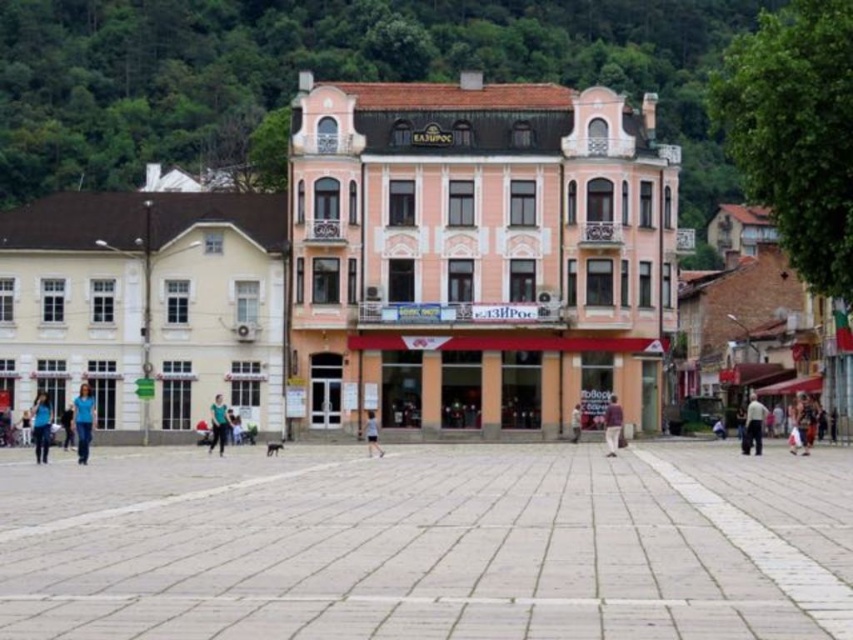
Consider the image. Who is shorter, blue fabric shirt at lower left or light brown leather jacket at center?

light brown leather jacket at center is shorter.

Measure the distance between blue fabric shirt at lower left and light brown leather jacket at center.

blue fabric shirt at lower left and light brown leather jacket at center are 33.66 meters apart.

Is point (33, 420) farther from viewer compared to point (578, 403)?

Yes, point (33, 420) is behind point (578, 403).

Identify the location of blue fabric shirt at lower left. (41, 426).

Does pink matte building at center have a larger size compared to blue fabric shirt at center?

Indeed, pink matte building at center has a larger size compared to blue fabric shirt at center.

Consider the image. Between pink matte building at center and blue fabric shirt at center, which one is positioned lower?

blue fabric shirt at center

What are the coordinates of `pink matte building at center` in the screenshot? It's located at (412, 250).

Locate an element on the screen. pink matte building at center is located at coordinates (412, 250).

Can you confirm if light brown leather pants at lower right is wider than brown leather jacket at center?

Yes.

Does point (761, 436) lie behind point (616, 442)?

No.

Locate an element on the screen. Image resolution: width=853 pixels, height=640 pixels. light brown leather pants at lower right is located at coordinates (753, 426).